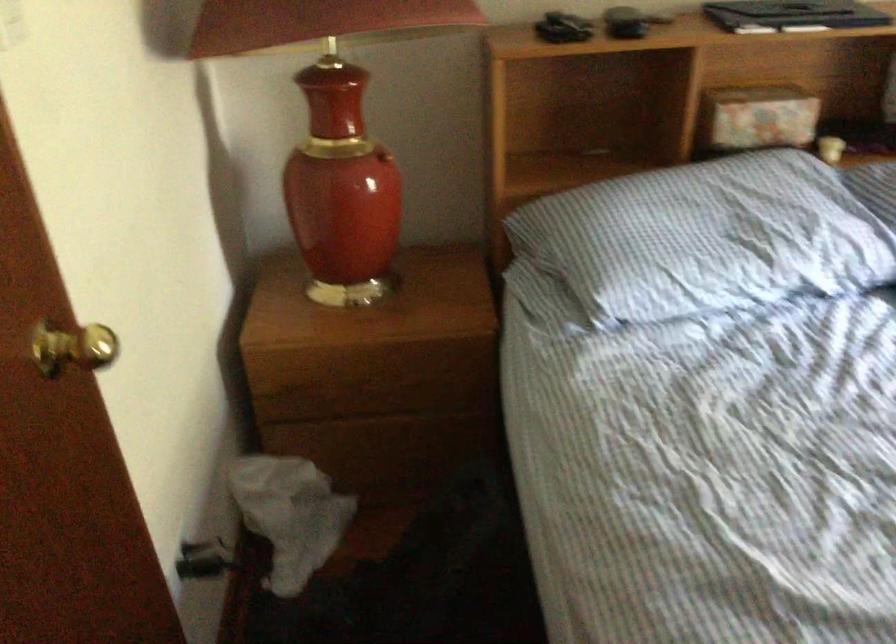
This screenshot has height=644, width=896. What are the coordinates of `white plastic bag` in the screenshot? It's located at (289, 515).